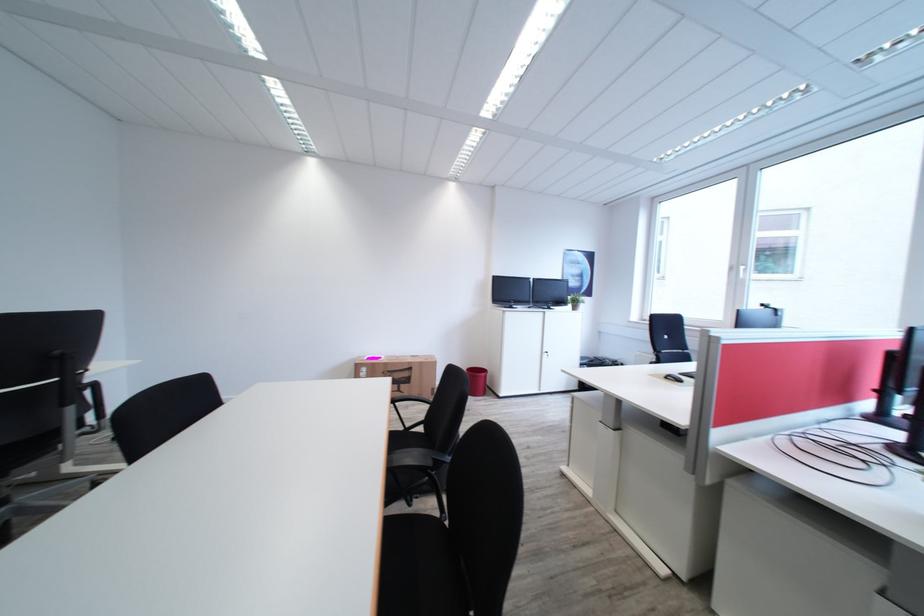
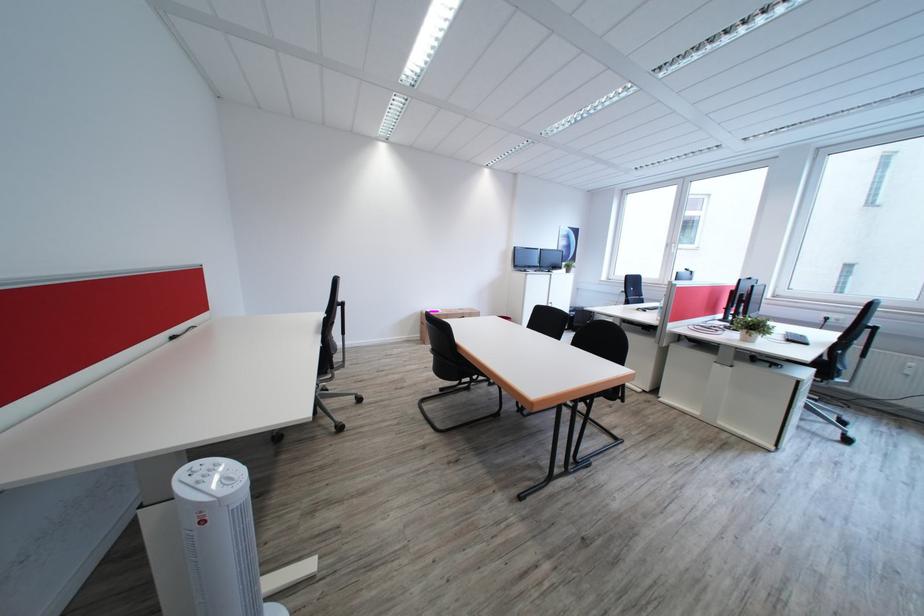
In the second image, find the point that corresponds to the point at 386,359 in the first image.

(445, 312)